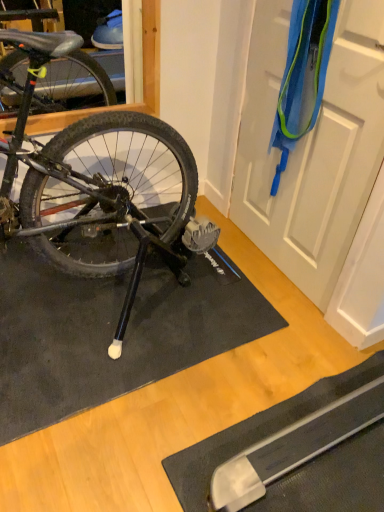
Question: Relative to white matte door at upper right, is black rubber doormat at lower left in front or behind?

Choices:
 (A) front
 (B) behind

Answer: (B)

Question: Considering the positions of black rubber doormat at lower left and white matte door at upper right in the image, is black rubber doormat at lower left wider or thinner than white matte door at upper right?

Choices:
 (A) wide
 (B) thin

Answer: (A)

Question: Visually, is black rubber doormat at lower left positioned to the left or to the right of white matte door at upper right?

Choices:
 (A) left
 (B) right

Answer: (A)

Question: Does point (360, 164) appear closer or farther from the camera than point (195, 320)?

Choices:
 (A) closer
 (B) farther

Answer: (A)

Question: From the image's perspective, relative to black rubber doormat at lower left, is white matte door at upper right above or below?

Choices:
 (A) above
 (B) below

Answer: (A)

Question: Is white matte door at upper right to the left or to the right of black rubber doormat at lower left in the image?

Choices:
 (A) left
 (B) right

Answer: (B)

Question: From a real-world perspective, is white matte door at upper right positioned above or below black rubber doormat at lower left?

Choices:
 (A) above
 (B) below

Answer: (A)